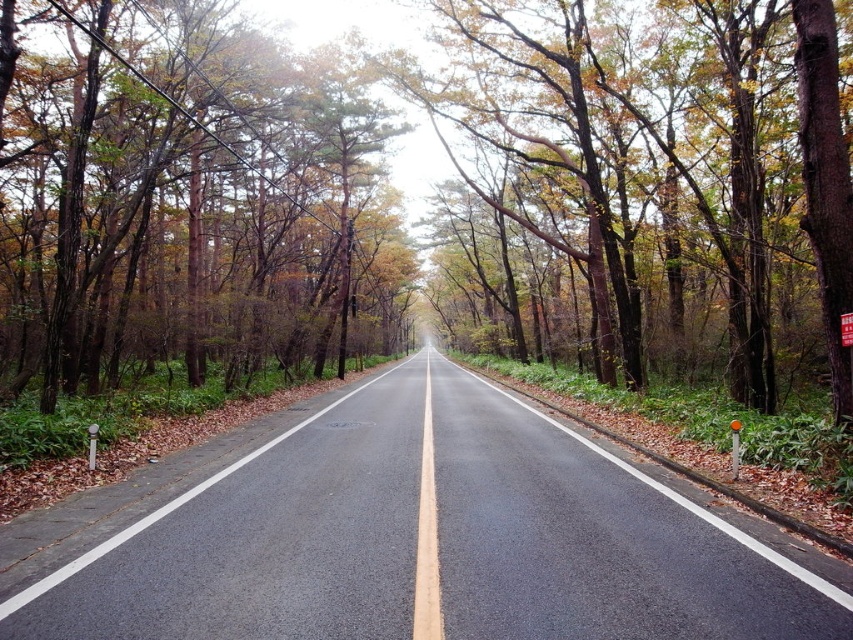
Who is taller, black asphalt road at center or brown wood tree at left?

brown wood tree at left is taller.

The height and width of the screenshot is (640, 853). What do you see at coordinates (430, 540) in the screenshot?
I see `black asphalt road at center` at bounding box center [430, 540].

The image size is (853, 640). What are the coordinates of `black asphalt road at center` in the screenshot? It's located at (430, 540).

Does brown wood tree at center have a greater height compared to brown wood tree at left?

Yes, brown wood tree at center is taller than brown wood tree at left.

Is brown wood tree at center below brown wood tree at left?

Actually, brown wood tree at center is above brown wood tree at left.

Who is more forward, (372, 333) or (364, 314)?

Positioned in front is point (364, 314).

Locate an element on the screen. The width and height of the screenshot is (853, 640). brown wood tree at center is located at coordinates (433, 195).

Who is lower down, brown wood tree at center or black asphalt road at center?

black asphalt road at center is below.

Does brown wood tree at center have a smaller size compared to black asphalt road at center?

No, brown wood tree at center is not smaller than black asphalt road at center.

In the scene shown: Who is more distant from viewer, (799,120) or (347,534)?

Point (799,120)

Where is `brown wood tree at center`? The width and height of the screenshot is (853, 640). brown wood tree at center is located at coordinates (433, 195).